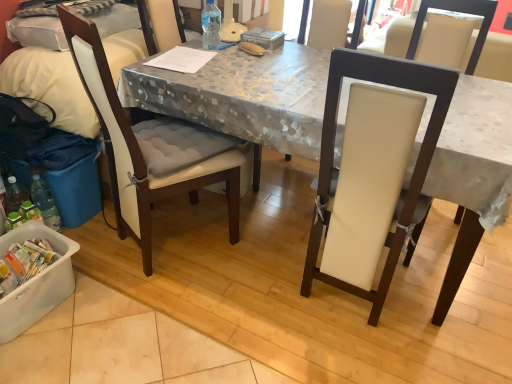
You are a GUI agent. You are given a task and a screenshot of the screen. Output one action in this format:
    pyautogui.click(x=<x>, y=<y>)
    Task: Click on the vacant area located to the right-hand side of white plastic container at lower left
    The height and width of the screenshot is (384, 512).
    Given the screenshot: What is the action you would take?
    pyautogui.click(x=106, y=311)